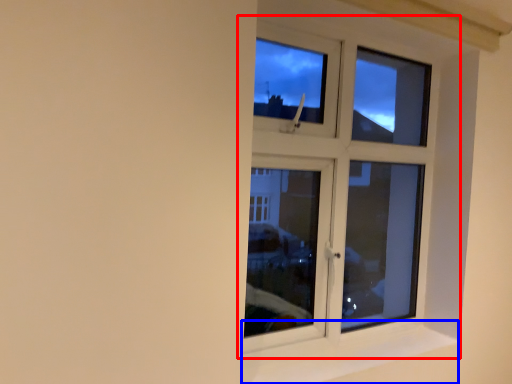
Question: Which of the following is the farthest to the observer, window (highlighted by a red box) or window sill (highlighted by a blue box)?

Choices:
 (A) window
 (B) window sill

Answer: (A)